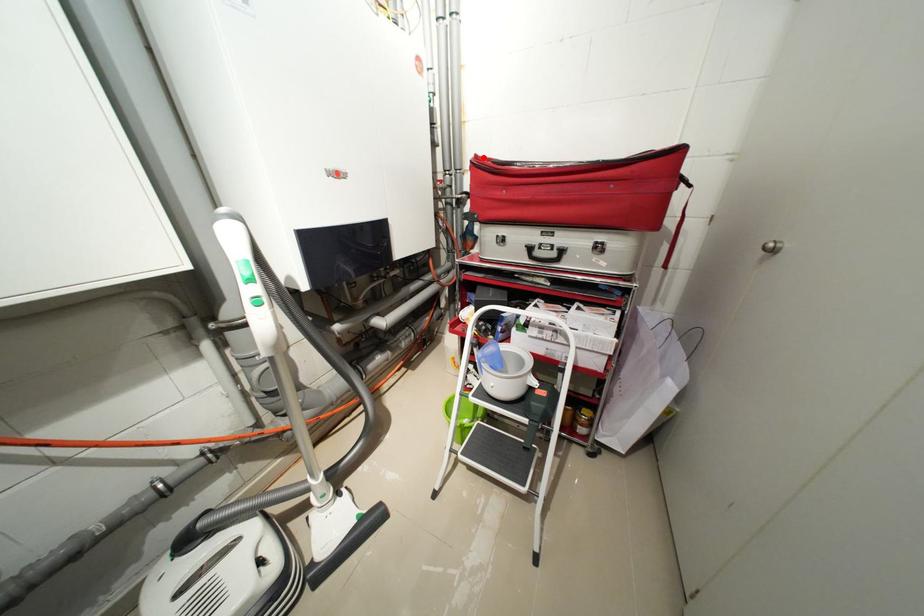
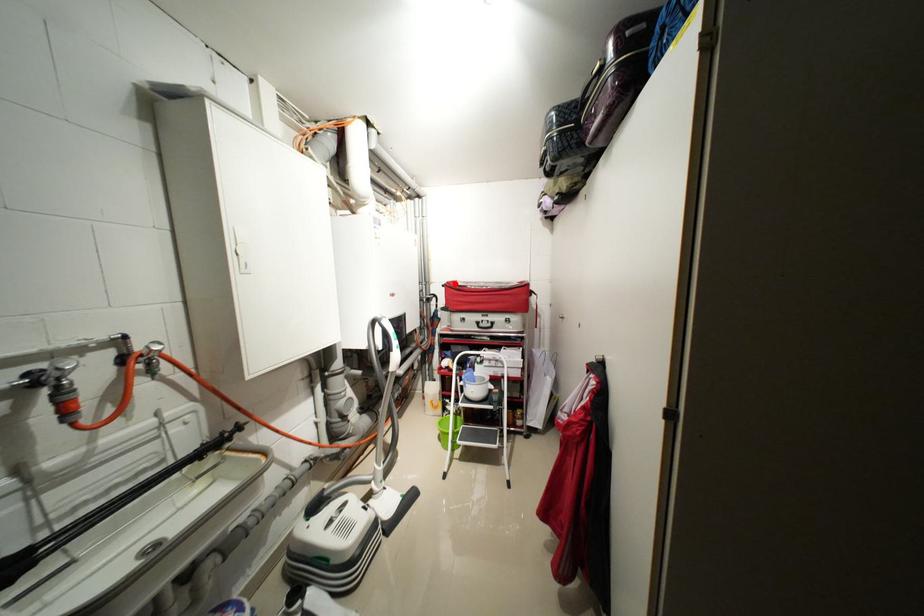
I am providing you with two images of the same scene from different viewpoints. A red point is marked on the first image and another point is marked on the second image. Do the highlighted points in image1 and image2 indicate the same real-world spot?

Yes